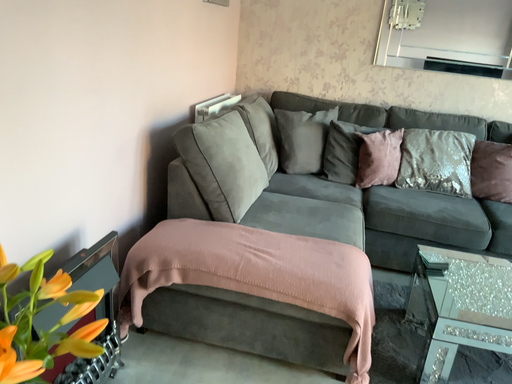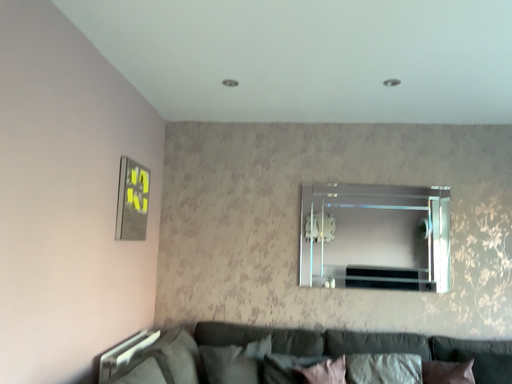
Question: Which way did the camera rotate in the video?

Choices:
 (A) rotated downward
 (B) rotated upward

Answer: (B)